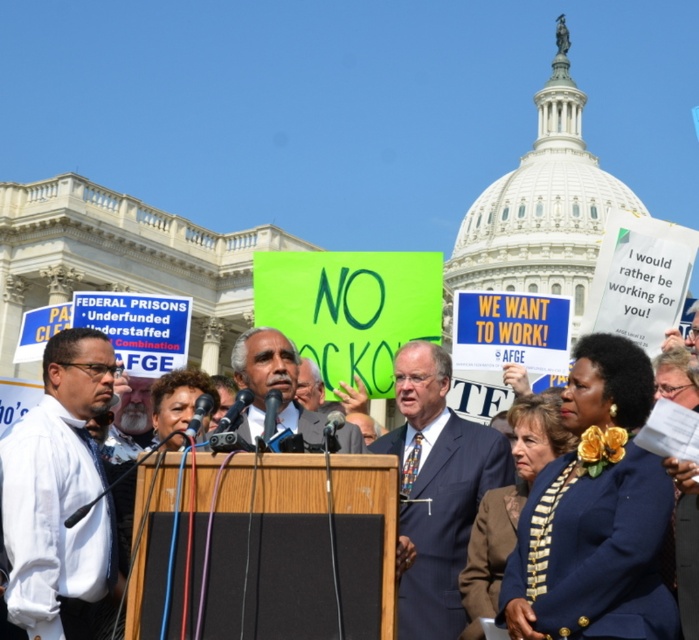
Question: Which object appears farthest from the camera in this image?

Choices:
 (A) white shirt at left
 (B) blue fabric suit at center
 (C) matte black suit at center
 (D) dark blue suit at center

Answer: (C)

Question: Is white shirt at left in front of dark blue suit at center?

Choices:
 (A) no
 (B) yes

Answer: (A)

Question: Can you confirm if white shirt at left is positioned above matte black suit at center?

Choices:
 (A) yes
 (B) no

Answer: (B)

Question: Which object is the farthest from the dark blue suit at center?

Choices:
 (A) matte black suit at center
 (B) white shirt at left
 (C) blue fabric suit at center

Answer: (B)

Question: Which object is positioned closest to the white shirt at left?

Choices:
 (A) matte black suit at center
 (B) dark blue suit at center

Answer: (A)

Question: Is white shirt at left closer to the viewer compared to blue fabric suit at center?

Choices:
 (A) no
 (B) yes

Answer: (B)